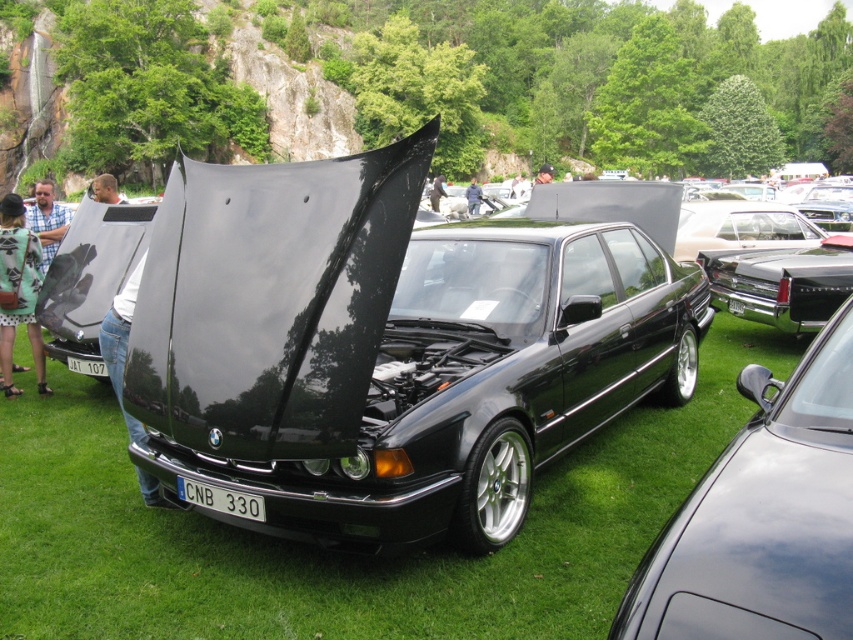
In the scene shown: You are a photographer positioned at the center of the scene. You need to capture a closeup shot of the black plastic license plate at center. Based on its coordinates, which direction should you move your camera to focus on it?

The black plastic license plate at center is located at point coordinates, so you should move your camera slightly to the right and downward to focus on it.

You are a photographer at the car show and need to capture both the black plastic license plate at center and the white plastic license plate at center in a single frame. Which license plate should you position to the left side of your camera viewfinder to include both?

The white plastic license plate at center should be positioned to the left side of your camera viewfinder because the black plastic license plate at center is to the right of it, ensuring both fit within the frame.

You are a photographer planning to take a wide shot of the car show. You have a camera that can capture a maximum width of 2 meters. Given that the glossy black car at center and the green textured dress at lower left are both in your frame, which object will require more careful positioning to ensure it fits within the camera frame?

The green textured dress at lower left requires more careful positioning because its width is greater than the glossy black car at center, so it might exceed the camera frame if not properly adjusted.